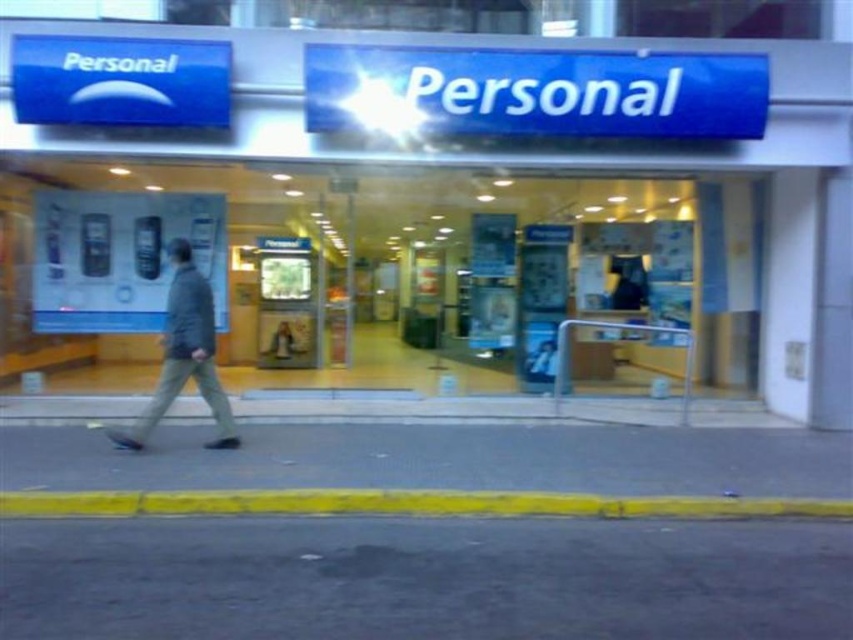
Is point (776, 445) farther from camera compared to point (158, 419)?

Yes, point (776, 445) is behind point (158, 419).

Where is `gray asphalt at lower center`? The height and width of the screenshot is (640, 853). gray asphalt at lower center is located at coordinates (440, 460).

Between point (238, 228) and point (357, 470), which one is positioned behind?

The point (238, 228) is more distant.

Between blue plastic sign at upper center and gray asphalt at lower center, which one is positioned lower?

gray asphalt at lower center

Is point (607, 198) in front of point (328, 470)?

No, (607, 198) is behind (328, 470).

The image size is (853, 640). Find the location of `blue plastic sign at upper center`. blue plastic sign at upper center is located at coordinates (457, 209).

Is blue plastic sign at upper center shorter than gray fabric jacket at left?

Incorrect, blue plastic sign at upper center's height does not fall short of gray fabric jacket at left's.

Who is more forward, (485, 163) or (167, 346)?

Positioned in front is point (167, 346).

Find the location of a particular element. blue plastic sign at upper center is located at coordinates (457, 209).